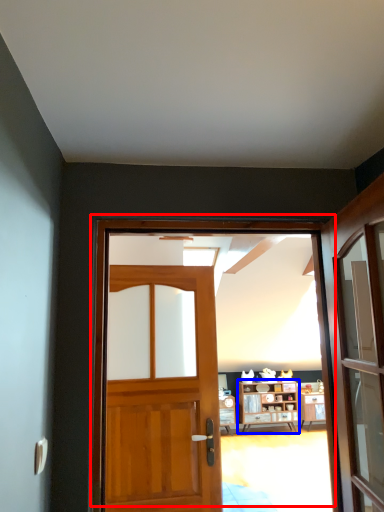
Question: Which point is closer to the camera, door (highlighted by a red box) or cabinetry (highlighted by a blue box)?

Choices:
 (A) door
 (B) cabinetry

Answer: (A)